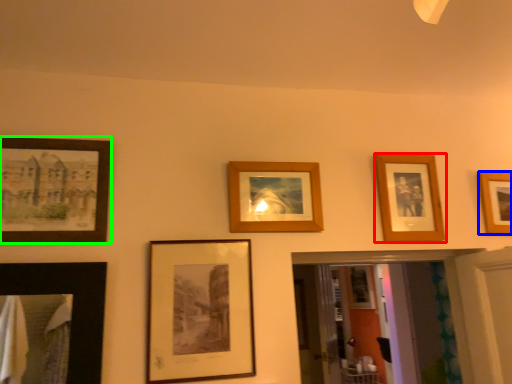
Question: Which object is the farthest from picture frame (highlighted by a red box)? Choose among these: picture frame (highlighted by a blue box) or picture frame (highlighted by a green box).

Choices:
 (A) picture frame
 (B) picture frame

Answer: (B)